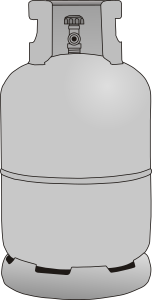
Find the location of a particular element. This screenshot has width=152, height=300. stand is located at coordinates (91, 286), (28, 276), (142, 274).